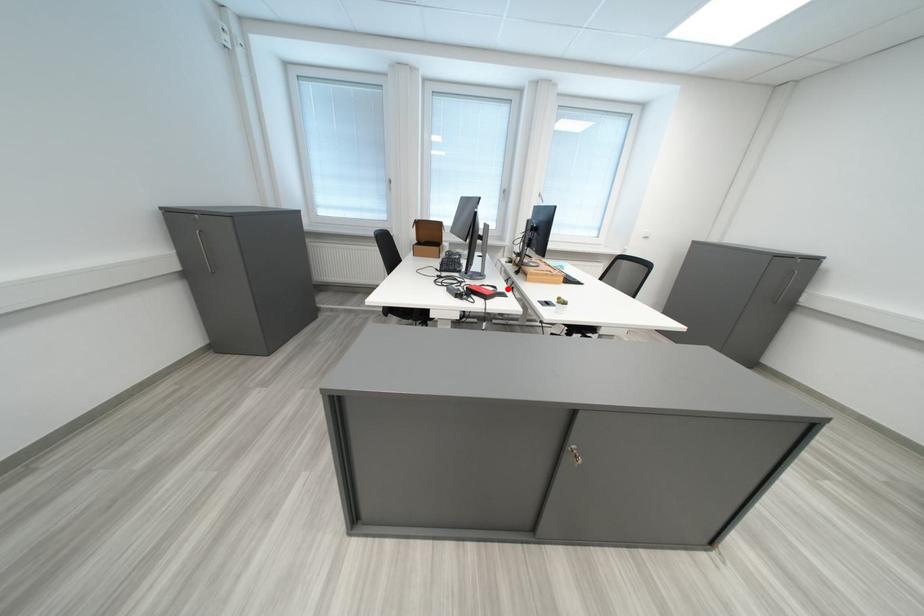
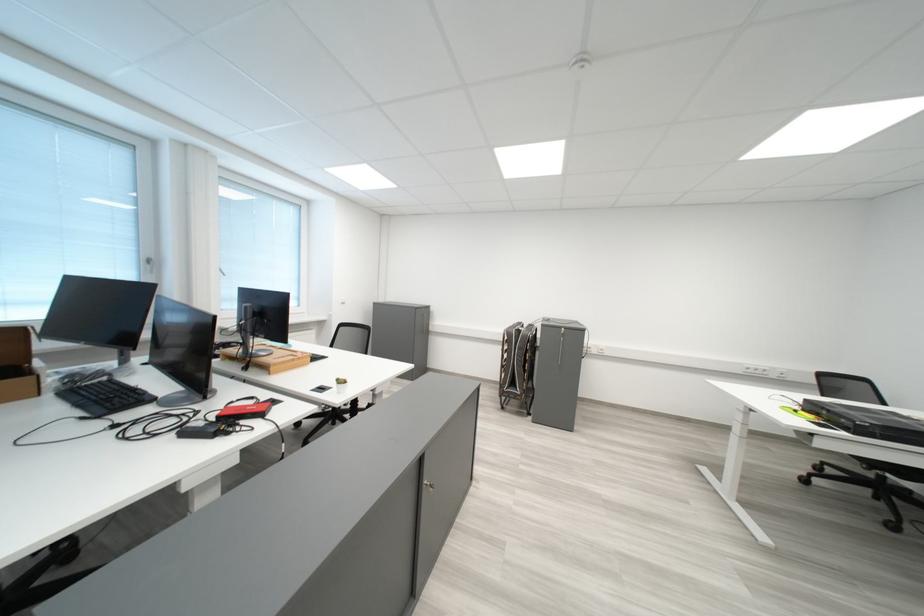
Find the pixel in the second image that matches the highlighted location in the first image.

(264, 400)